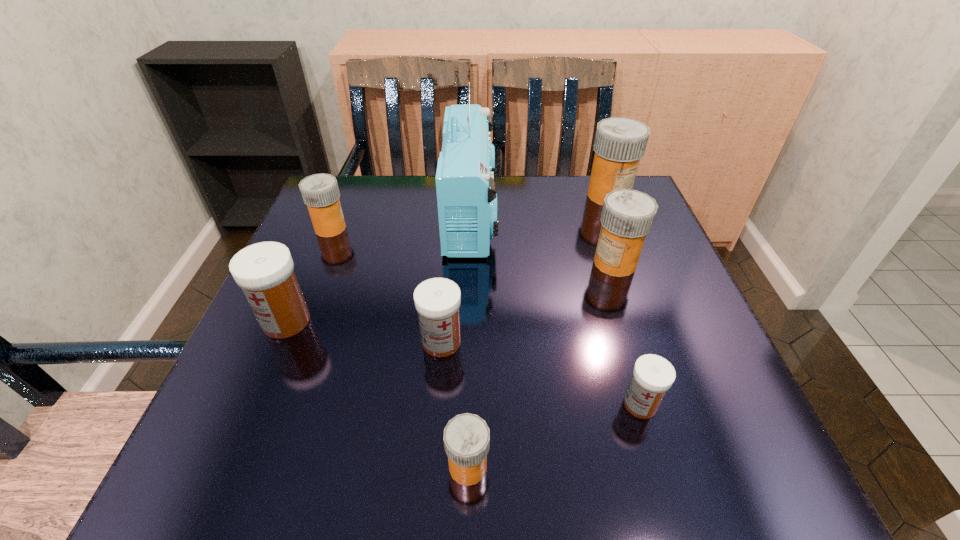
Locate an element on the screen. This screenshot has height=540, width=960. white medicine that is the second closest to the smallest orange medicine is located at coordinates (653, 375).

In order to click on the second closest white medicine to the nearest medicine in this screenshot , I will do `click(653, 375)`.

Find the location of a particular element. This screenshot has width=960, height=540. free spot that satisfies the following two spatial constraints: 1. on the front-facing side of the tallest object; 2. on the back side of the second nearest object is located at coordinates click(466, 404).

This screenshot has height=540, width=960. I want to click on free spot that satisfies the following two spatial constraints: 1. on the label side of the second smallest white medicine; 2. on the left side of the leftmost orange medicine, so click(283, 342).

You are a GUI agent. You are given a task and a screenshot of the screen. Output one action in this format:
    pyautogui.click(x=<x>, y=<y>)
    Task: Click on the free spot that satisfies the following two spatial constraints: 1. on the label side of the second farthest orange medicine; 2. on the back side of the second white medicine from right to left
    This screenshot has width=960, height=540.
    Given the screenshot: What is the action you would take?
    pyautogui.click(x=283, y=342)

The height and width of the screenshot is (540, 960). I want to click on free spot that satisfies the following two spatial constraints: 1. on the label side of the tallest medicine; 2. on the label side of the second biggest orange medicine, so click(635, 263).

Find the location of `free space that satisfies the following two spatial constraints: 1. on the front-facing side of the blue radio receiver; 2. on the back side of the second nearest object`. free space that satisfies the following two spatial constraints: 1. on the front-facing side of the blue radio receiver; 2. on the back side of the second nearest object is located at coordinates (466, 404).